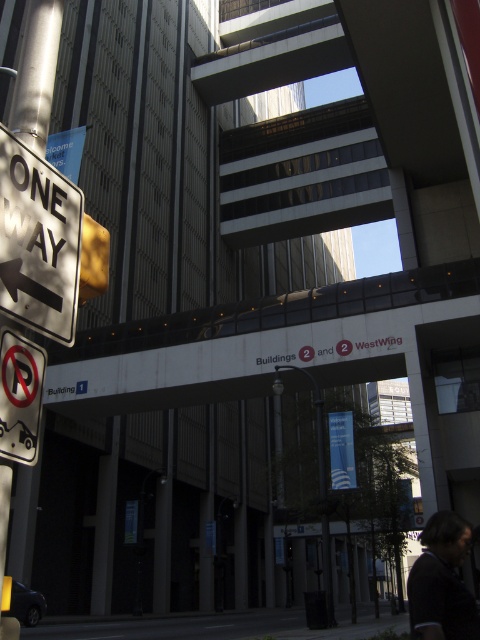
You are standing at the entrance of Buildings 2 and 2 West Wing and see two points marked on the ground. The first point is at coordinate point (64, 250) and the second point is at coordinate point (29, 355). Which point is closer to you?

Point (64, 250) is closer to you because it is further to the viewer than point (29, 355).

Consider the image. You are a delivery driver navigating through the urban scene. You see the white concrete overpass at center. Based on its position, can you estimate where it is located in the image?

The white concrete overpass at center is located at the coordinates point (x=256, y=342) in the image.

You are standing at the intersection near the ONE WAY street sign and need to approach the Buildings 2 and 2 West Wing entrance. Which of the two points, point (265, 348) or point (72, 292), is closer to you as you approach the entrance?

Point (265, 348) is closer to you because it is further to the viewer than point (72, 292), meaning it is nearer in the scene.